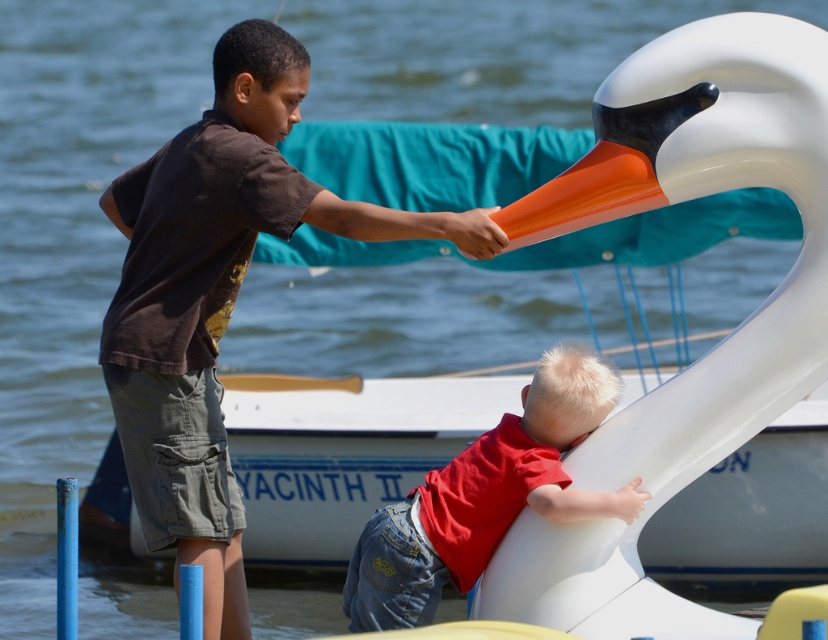
Is brown cotton shirt at upper left positioned at the back of red matte shirt at lower center?

No, it is in front of red matte shirt at lower center.

Which is in front, point (135, 419) or point (521, 483)?

Point (521, 483) is more forward.

Find the location of `brown cotton shirt at upper left`. brown cotton shirt at upper left is located at coordinates (217, 296).

Is white glossy swan at upper right bigger than red matte shirt at lower center?

Yes, white glossy swan at upper right is bigger than red matte shirt at lower center.

Which is behind, point (816, 180) or point (498, 445)?

Positioned behind is point (498, 445).

Which is in front, point (758, 624) or point (542, 387)?

Point (542, 387) is in front.

Find the location of a particular element. Image resolution: width=828 pixels, height=640 pixels. white glossy swan at upper right is located at coordinates (706, 353).

Between white glossy swan at upper right and brown cotton shirt at upper left, which one has more height?

brown cotton shirt at upper left is taller.

Does point (757, 342) lie behind point (167, 312)?

No, it is not.

What do you see at coordinates (706, 353) in the screenshot? I see `white glossy swan at upper right` at bounding box center [706, 353].

Find the location of a particular element. The height and width of the screenshot is (640, 828). white glossy swan at upper right is located at coordinates (706, 353).